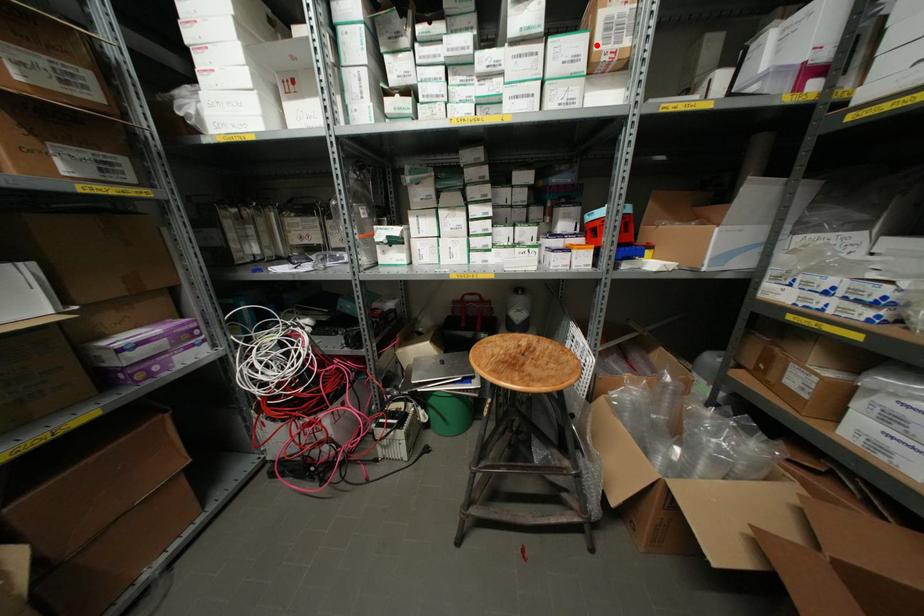
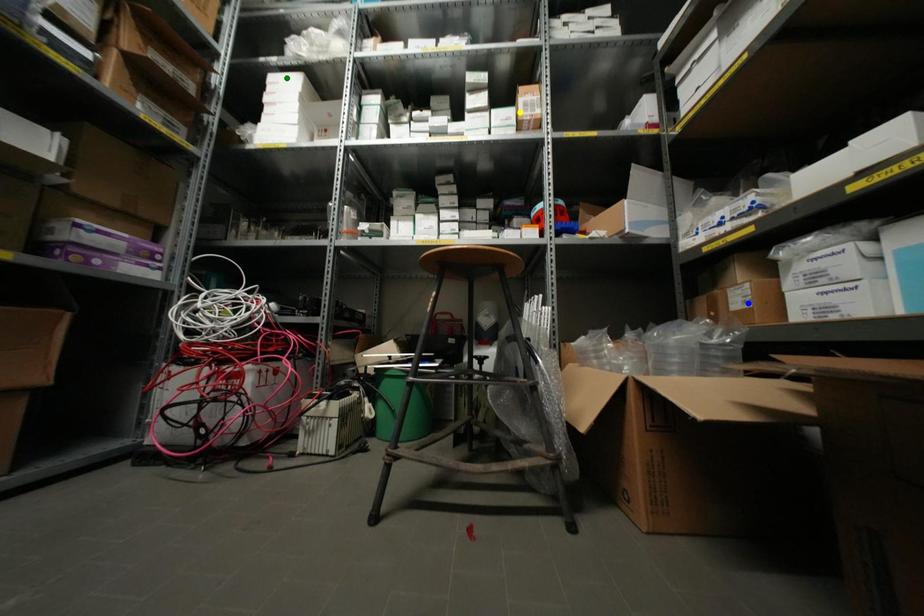
Question: I am providing you with two images of the same scene from different viewpoints. A red point is marked on the first image. You are given multiple points on the second image. Which spot in image 2 lines up with the point in image 1?

Choices:
 (A) yellow point
 (B) green point
 (C) blue point

Answer: (A)